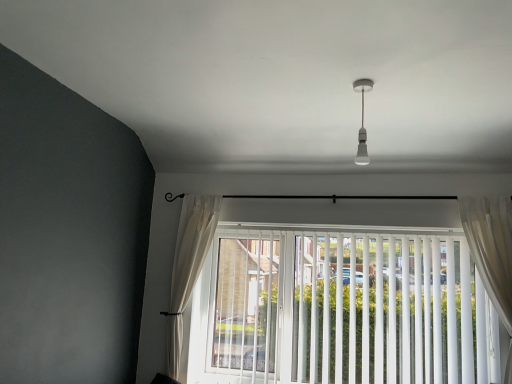
Question: Considering the relative positions of white sheer curtain at left, the 2th curtain viewed from the right, and white vertical blinds at center in the image provided, is white sheer curtain at left, the 2th curtain viewed from the right, to the right of white vertical blinds at center from the viewer's perspective?

Choices:
 (A) no
 (B) yes

Answer: (A)

Question: Does white sheer curtain at left, the second curtain positioned from the front, have a lesser width compared to white vertical blinds at center?

Choices:
 (A) yes
 (B) no

Answer: (B)

Question: Is white sheer curtain at left, the first curtain when ordered from back to front, positioned in front of white vertical blinds at center?

Choices:
 (A) yes
 (B) no

Answer: (B)

Question: Does white sheer curtain at left, the second curtain positioned from the front, have a larger size compared to white vertical blinds at center?

Choices:
 (A) yes
 (B) no

Answer: (B)

Question: From a real-world perspective, is white sheer curtain at left, the 2th curtain viewed from the right, beneath white vertical blinds at center?

Choices:
 (A) yes
 (B) no

Answer: (B)

Question: Considering the positions of point (471, 218) and point (195, 201), is point (471, 218) closer or farther from the camera than point (195, 201)?

Choices:
 (A) farther
 (B) closer

Answer: (B)

Question: In terms of height, does sheer white curtain at right, the 2th curtain in the left-to-right sequence, look taller or shorter compared to white sheer curtain at left, the second curtain positioned from the front?

Choices:
 (A) short
 (B) tall

Answer: (A)

Question: In terms of size, does sheer white curtain at right, the 1th curtain positioned from the front, appear bigger or smaller than white sheer curtain at left, the second curtain positioned from the front?

Choices:
 (A) small
 (B) big

Answer: (A)

Question: Looking at their shapes, would you say sheer white curtain at right, the 1th curtain positioned from the front, is wider or thinner than white sheer curtain at left, the second curtain positioned from the front?

Choices:
 (A) thin
 (B) wide

Answer: (A)

Question: From the image's perspective, relative to white glossy bulb at upper center, is white sheer curtain at left, positioned as the first curtain in left-to-right order, above or below?

Choices:
 (A) below
 (B) above

Answer: (A)

Question: From a real-world perspective, is white sheer curtain at left, the first curtain when ordered from back to front, physically located above or below white glossy bulb at upper center?

Choices:
 (A) below
 (B) above

Answer: (A)

Question: Looking at their shapes, would you say white sheer curtain at left, positioned as the first curtain in left-to-right order, is wider or thinner than white glossy bulb at upper center?

Choices:
 (A) wide
 (B) thin

Answer: (A)

Question: Considering the positions of point (195, 200) and point (361, 112), is point (195, 200) closer or farther from the camera than point (361, 112)?

Choices:
 (A) closer
 (B) farther

Answer: (B)

Question: Is white sheer curtain at left, the 2th curtain viewed from the right, inside or outside of sheer white curtain at right, the second curtain when ordered from back to front?

Choices:
 (A) inside
 (B) outside

Answer: (B)

Question: Looking at the image, does white sheer curtain at left, the 2th curtain viewed from the right, seem bigger or smaller compared to sheer white curtain at right, which is the first curtain in right-to-left order?

Choices:
 (A) big
 (B) small

Answer: (A)